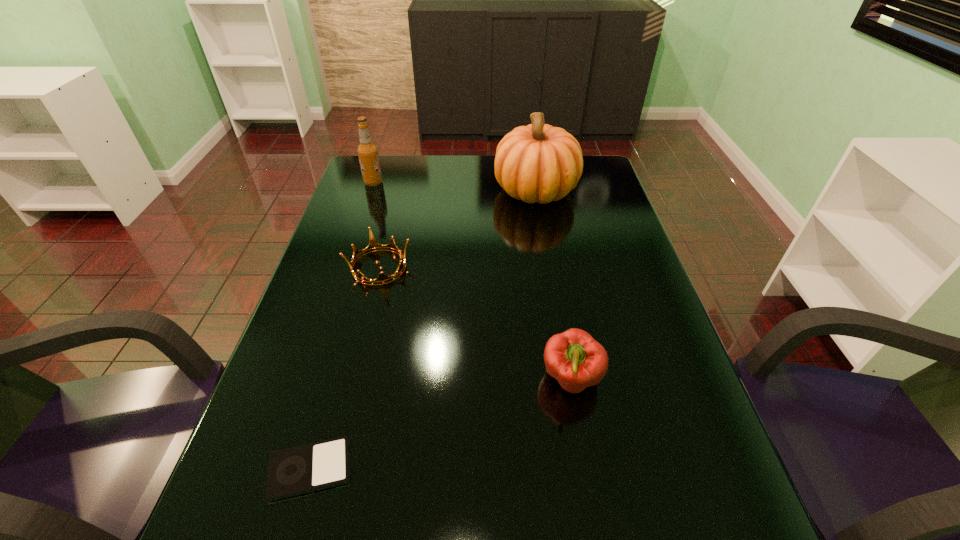
Where is `vacant space that satisfies the following two spatial constraints: 1. on the back side of the bell pepper; 2. on the left side of the shortest object`? The width and height of the screenshot is (960, 540). vacant space that satisfies the following two spatial constraints: 1. on the back side of the bell pepper; 2. on the left side of the shortest object is located at coordinates (335, 380).

This screenshot has width=960, height=540. What are the coordinates of `vacant space that satisfies the following two spatial constraints: 1. on the front label of the beer bottle; 2. on the back side of the pumpkin` in the screenshot? It's located at (371, 190).

Find the location of `free space that satisfies the following two spatial constraints: 1. on the back side of the bell pepper; 2. on the left side of the shortest object`. free space that satisfies the following two spatial constraints: 1. on the back side of the bell pepper; 2. on the left side of the shortest object is located at coordinates (335, 380).

Identify the location of vacant area in the image that satisfies the following two spatial constraints: 1. on the front label of the iPod; 2. on the right side of the beer bottle. (277, 469).

Locate an element on the screen. The height and width of the screenshot is (540, 960). free space that satisfies the following two spatial constraints: 1. on the front label of the beer bottle; 2. on the left side of the fourth farthest object is located at coordinates (307, 380).